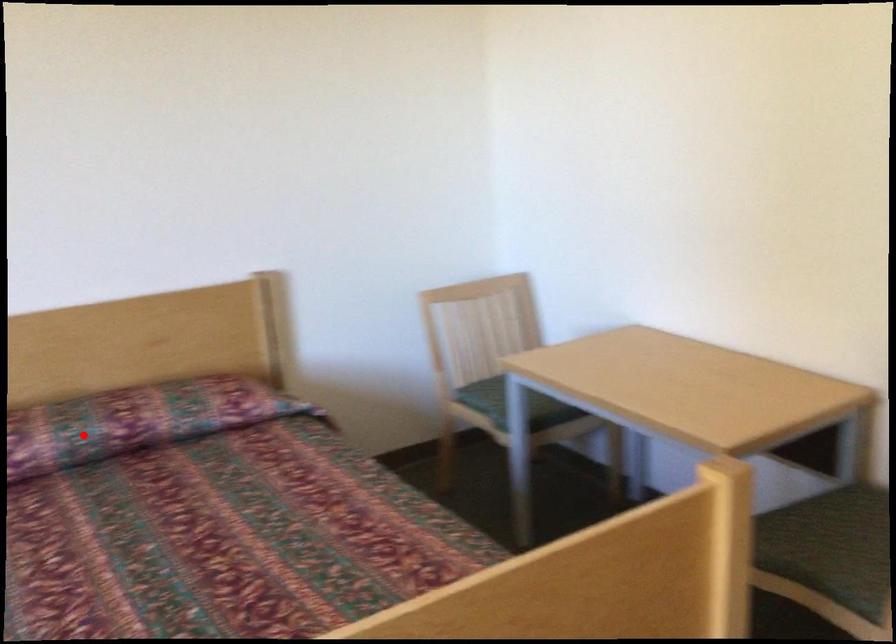
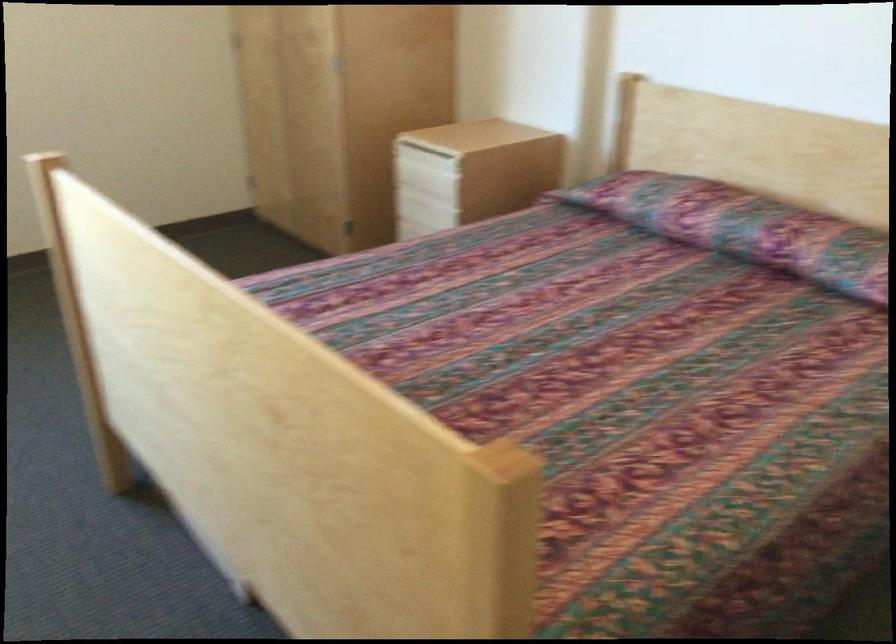
In the second image, find the point that corresponds to the highlighted location in the first image.

(744, 227)